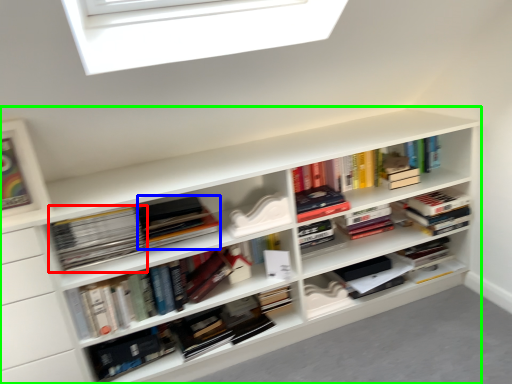
Question: Estimate the real-world distances between objects in this image. Which object is farther from book (highlighted by a red box), book (highlighted by a blue box) or shelf (highlighted by a green box)?

Choices:
 (A) book
 (B) shelf

Answer: (B)